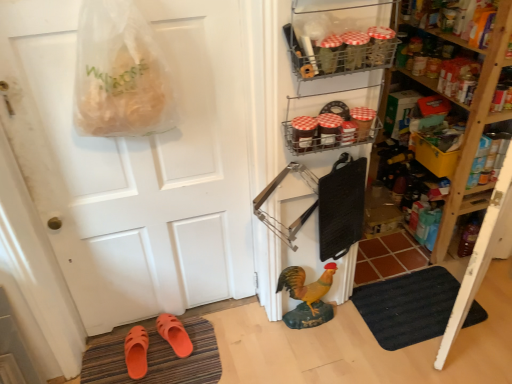
The height and width of the screenshot is (384, 512). I want to click on empty space that is in between painted wood rooster at lower center and black rubber doormat at lower right, placed as the 2th doormat when sorted from left to right, so click(x=340, y=332).